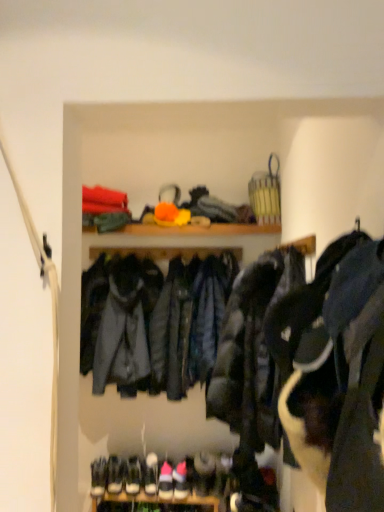
Question: Can you confirm if white leather sneaker at lower center, placed as the first shoe when sorted from left to right, is positioned to the right of white suede sneaker at lower center, marked as the second footwear in a left-to-right arrangement?

Choices:
 (A) yes
 (B) no

Answer: (A)

Question: From a real-world perspective, is white leather sneaker at lower center, placed as the first shoe when sorted from left to right, physically above white suede sneaker at lower center, which is the second footwear in right-to-left order?

Choices:
 (A) no
 (B) yes

Answer: (B)

Question: Is white leather sneaker at lower center, marked as the 2th shoe in a right-to-left arrangement, closer to the viewer compared to white suede sneaker at lower center, which is the second footwear in right-to-left order?

Choices:
 (A) yes
 (B) no

Answer: (B)

Question: From a real-world perspective, is white leather sneaker at lower center, placed as the first shoe when sorted from left to right, positioned under white suede sneaker at lower center, which is the second footwear in right-to-left order, based on gravity?

Choices:
 (A) no
 (B) yes

Answer: (A)

Question: Is white leather sneaker at lower center, marked as the 2th shoe in a right-to-left arrangement, to the left of white suede sneaker at lower center, marked as the second footwear in a left-to-right arrangement, from the viewer's perspective?

Choices:
 (A) no
 (B) yes

Answer: (A)

Question: Is the position of white leather sneaker at lower center, placed as the first shoe when sorted from left to right, more distant than that of white suede sneaker at lower center, which is the second footwear in right-to-left order?

Choices:
 (A) no
 (B) yes

Answer: (B)

Question: Does white suede sneakers at lower center, placed as the first footwear when sorted from right to left, have a smaller size compared to dark blue leather jacket at center, acting as the first jacket starting from the back?

Choices:
 (A) no
 (B) yes

Answer: (B)

Question: Is white suede sneakers at lower center, placed as the first footwear when sorted from right to left, taller than dark blue leather jacket at center, acting as the second jacket starting from the front?

Choices:
 (A) yes
 (B) no

Answer: (B)

Question: Is white suede sneakers at lower center, the 3th footwear in the left-to-right sequence, outside of dark blue leather jacket at center, acting as the second jacket starting from the front?

Choices:
 (A) yes
 (B) no

Answer: (A)

Question: Is white suede sneakers at lower center, the 3th footwear in the left-to-right sequence, bigger than dark blue leather jacket at center, acting as the first jacket starting from the back?

Choices:
 (A) no
 (B) yes

Answer: (A)

Question: Does white suede sneakers at lower center, placed as the first footwear when sorted from right to left, turn towards dark blue leather jacket at center, acting as the second jacket starting from the front?

Choices:
 (A) yes
 (B) no

Answer: (B)

Question: Does white suede sneakers at lower center, placed as the first footwear when sorted from right to left, lie behind dark blue leather jacket at center, acting as the first jacket starting from the back?

Choices:
 (A) yes
 (B) no

Answer: (A)

Question: From a real-world perspective, is white suede sneakers at lower center, the 3th footwear in the left-to-right sequence, on top of white leather sneaker at lower center, placed as the first shoe when sorted from left to right?

Choices:
 (A) yes
 (B) no

Answer: (B)